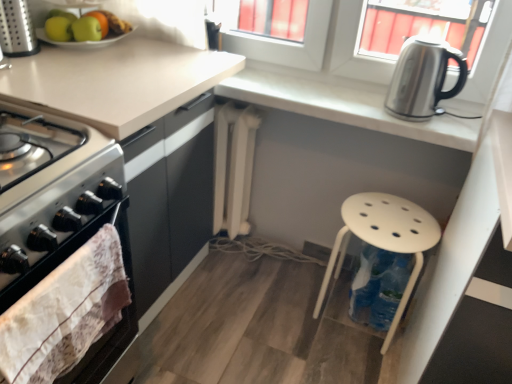
This screenshot has width=512, height=384. Identify the location of free space in front of green matte apple at upper left, acting as the second apple starting from the left. (70, 57).